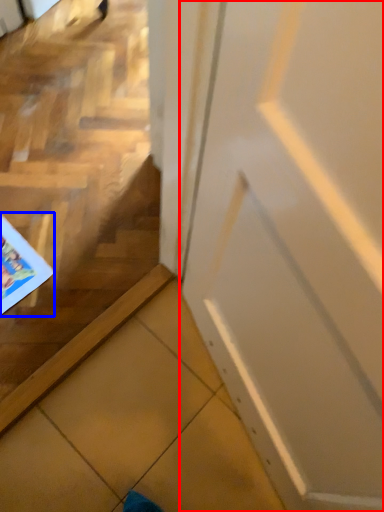
Question: Which object is further to the camera taking this photo, door (highlighted by a red box) or comic book (highlighted by a blue box)?

Choices:
 (A) door
 (B) comic book

Answer: (B)